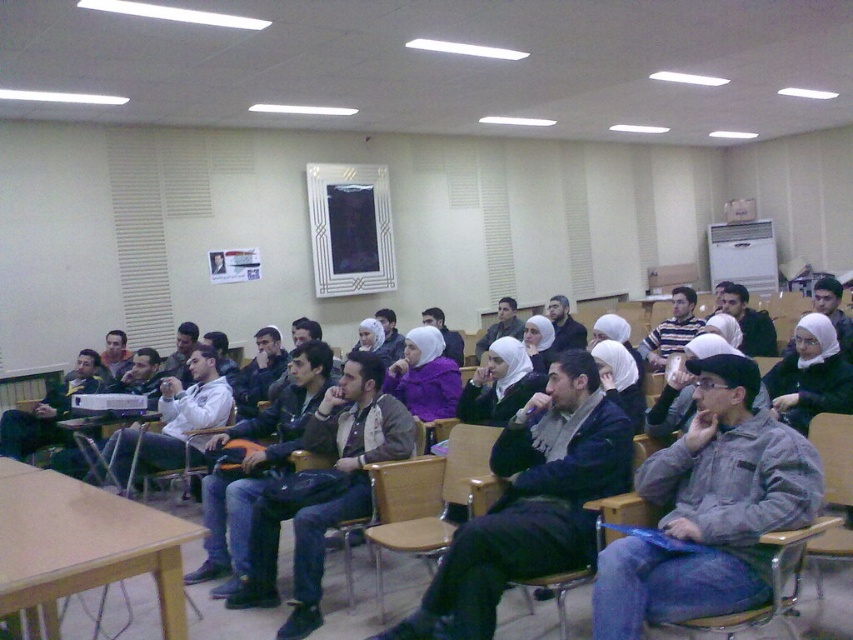
Question: Which point is closer to the camera?

Choices:
 (A) (299, 502)
 (B) (212, 419)

Answer: (A)

Question: Which point is closer to the camera?

Choices:
 (A) (367, 529)
 (B) (337, 502)

Answer: (A)

Question: Which point is farther to the camera?

Choices:
 (A) gray fuzzy jacket at center
 (B) dark gray jacket at center

Answer: (B)

Question: Does gray fuzzy jacket at center appear over dark gray sweater at center?

Choices:
 (A) yes
 (B) no

Answer: (A)

Question: Is dark gray sweater at center further to camera compared to dark gray jacket at center?

Choices:
 (A) yes
 (B) no

Answer: (B)

Question: Does gray fuzzy jacket at center come in front of dark gray jacket at center?

Choices:
 (A) no
 (B) yes

Answer: (B)